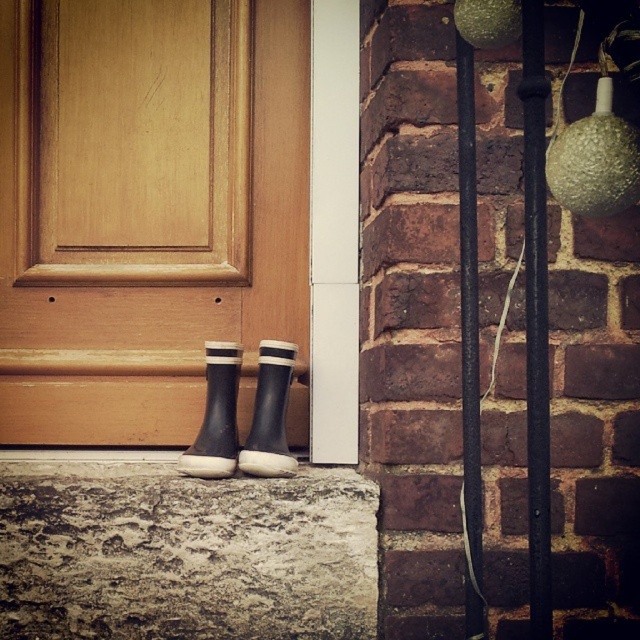
The width and height of the screenshot is (640, 640). What do you see at coordinates (147, 211) in the screenshot? I see `matte wood door at lower center` at bounding box center [147, 211].

Who is higher up, matte wood door at lower center or rubber matte boot at center?

matte wood door at lower center is above.

Describe the element at coordinates (147, 211) in the screenshot. Image resolution: width=640 pixels, height=640 pixels. I see `matte wood door at lower center` at that location.

Identify the location of matte wood door at lower center. The height and width of the screenshot is (640, 640). (147, 211).

Is matte wood door at lower center wider than black rubber boot at lower center?

Correct, the width of matte wood door at lower center exceeds that of black rubber boot at lower center.

Between matte wood door at lower center and black rubber boot at lower center, which one has less height?

black rubber boot at lower center

The image size is (640, 640). Describe the element at coordinates (147, 211) in the screenshot. I see `matte wood door at lower center` at that location.

Locate an element on the screen. matte wood door at lower center is located at coordinates (147, 211).

Between black rubber boot at lower center and rubber matte boot at center, which one appears on the left side from the viewer's perspective?

black rubber boot at lower center is more to the left.

Is black rubber boot at lower center shorter than rubber matte boot at center?

No, black rubber boot at lower center is not shorter than rubber matte boot at center.

Between point (211, 353) and point (253, 456), which one is positioned in front?

Positioned in front is point (253, 456).

Identify the location of black rubber boot at lower center. click(216, 416).